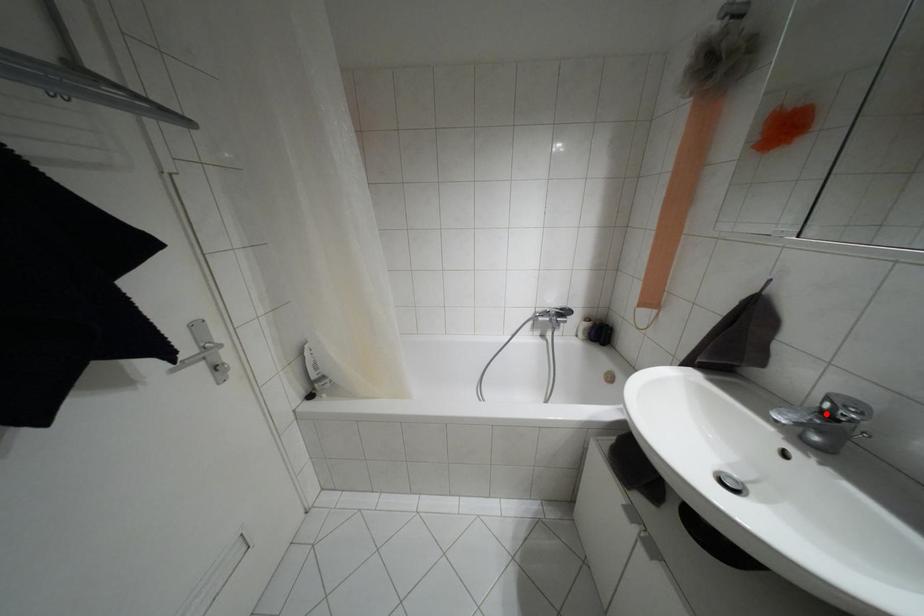
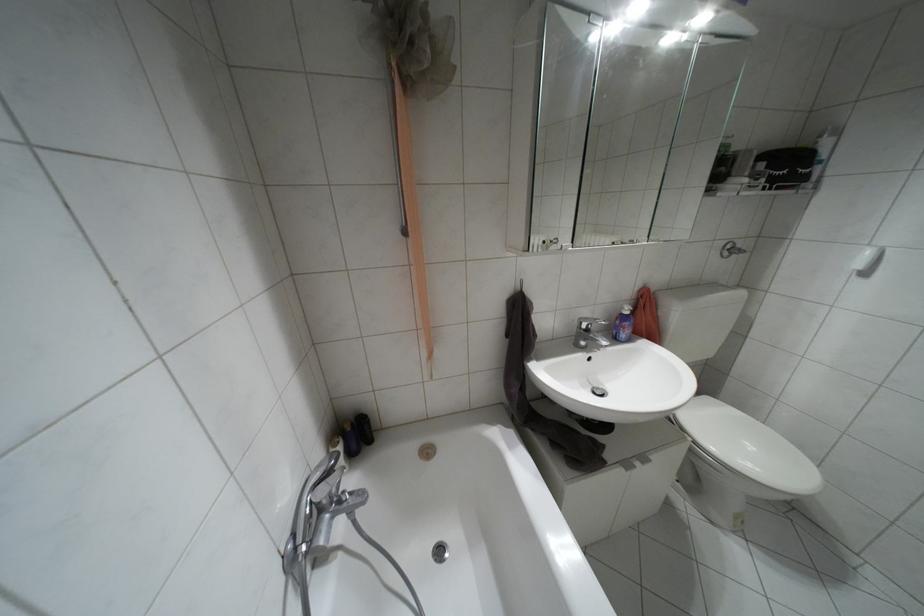
Find the pixel in the second image that matches the highlighted location in the first image.

(587, 330)